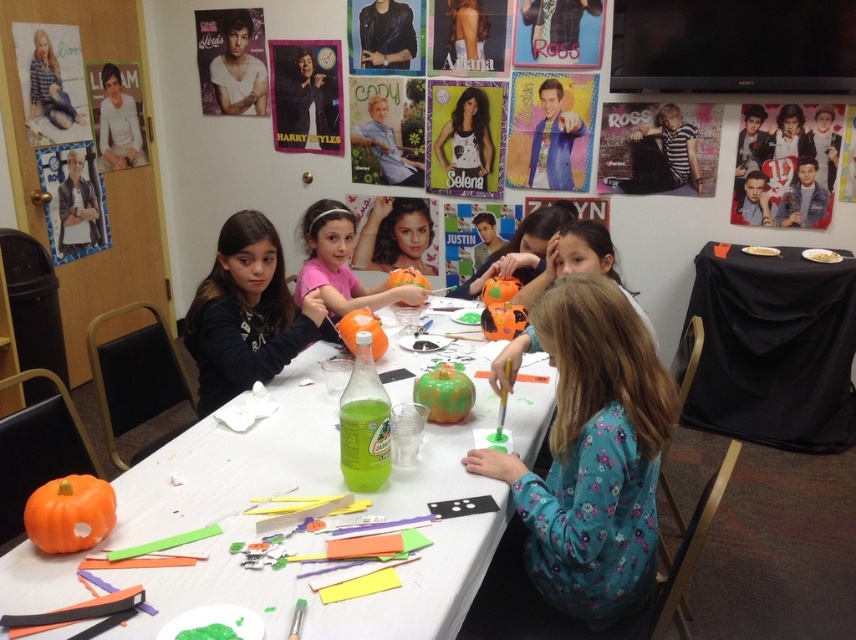
Question: Is black cloth table at lower right positioned behind pink fabric shirt at center?

Choices:
 (A) no
 (B) yes

Answer: (B)

Question: Can you confirm if pink fabric shirt at center is thinner than matte orange pumpkin at center?

Choices:
 (A) yes
 (B) no

Answer: (B)

Question: Among these points, which one is farthest from the camera?

Choices:
 (A) (217, 266)
 (B) (345, 284)

Answer: (B)

Question: Which object is closer to the camera taking this photo?

Choices:
 (A) matte orange pumpkin at lower left
 (B) black cloth table at lower right
 (C) pink fabric shirt at center

Answer: (A)

Question: Which object is the closest to the pink fabric shirt at center?

Choices:
 (A) floral fabric shirt at center
 (B) matte black shirt at center
 (C) matte orange pumpkin at lower left

Answer: (B)

Question: Does floral fabric shirt at center have a lesser width compared to matte black poster at upper center?

Choices:
 (A) yes
 (B) no

Answer: (B)